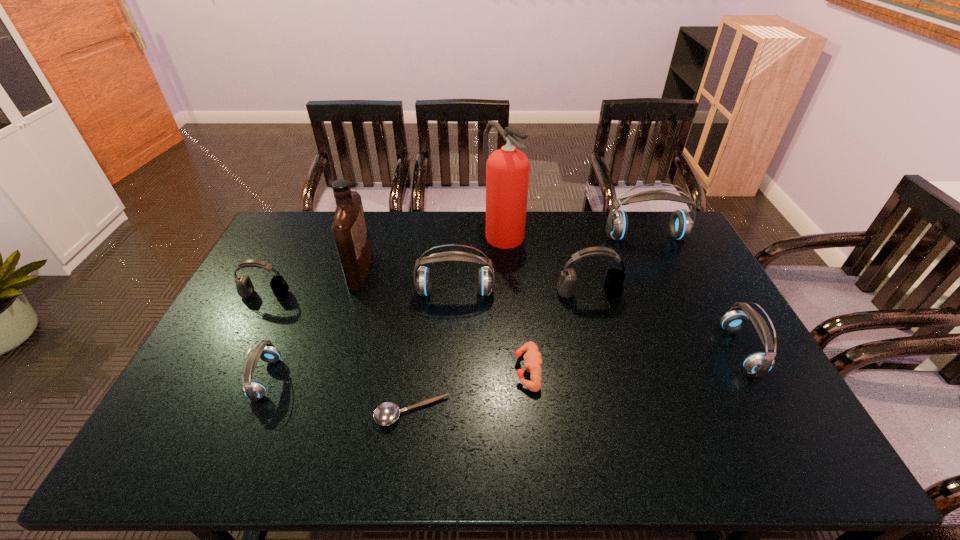
This screenshot has width=960, height=540. I want to click on red fire extinguisher, so click(x=507, y=169).

Where is `the tallest object`? This screenshot has width=960, height=540. the tallest object is located at coordinates (507, 169).

The width and height of the screenshot is (960, 540). In order to click on the third object from left to right in this screenshot , I will do `click(349, 228)`.

Identify the location of liquor. This screenshot has height=540, width=960. (349, 228).

The image size is (960, 540). Identify the location of the biggest blue headset. (681, 223).

Locate an element on the screen. The height and width of the screenshot is (540, 960). the farthest blue headset is located at coordinates (681, 223).

This screenshot has width=960, height=540. I want to click on the right black headset, so click(613, 286).

Locate an element on the screen. the bigger black headset is located at coordinates click(x=613, y=286).

You are a GUI agent. You are given a task and a screenshot of the screen. Output one action in this format:
    pyautogui.click(x=<x>, y=<y>)
    Task: Click on the second blue headset from left to right
    This screenshot has width=960, height=540.
    Given the screenshot: What is the action you would take?
    pyautogui.click(x=423, y=279)

At what (x,y) coordinates should I click in order to perform the action: click on the second biggest blue headset. Please return your answer as a coordinate pair (x, y). The width and height of the screenshot is (960, 540). Looking at the image, I should click on (423, 279).